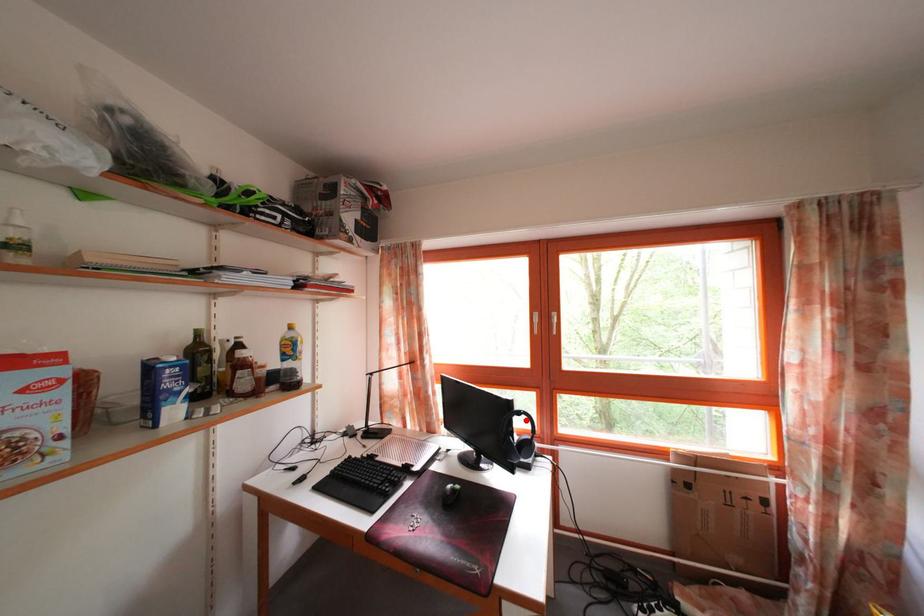
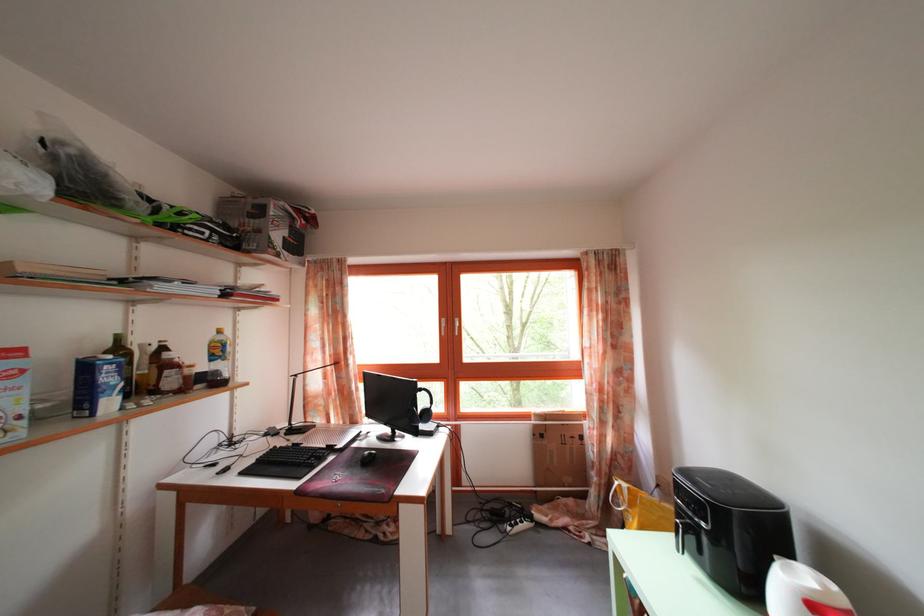
Question: I am providing you with two images of the same scene from different viewpoints. In image1, a red point is highlighted. Considering the same 3D point in image2, which of the following is correct?

Choices:
 (A) It is closer
 (B) It is farther

Answer: (A)